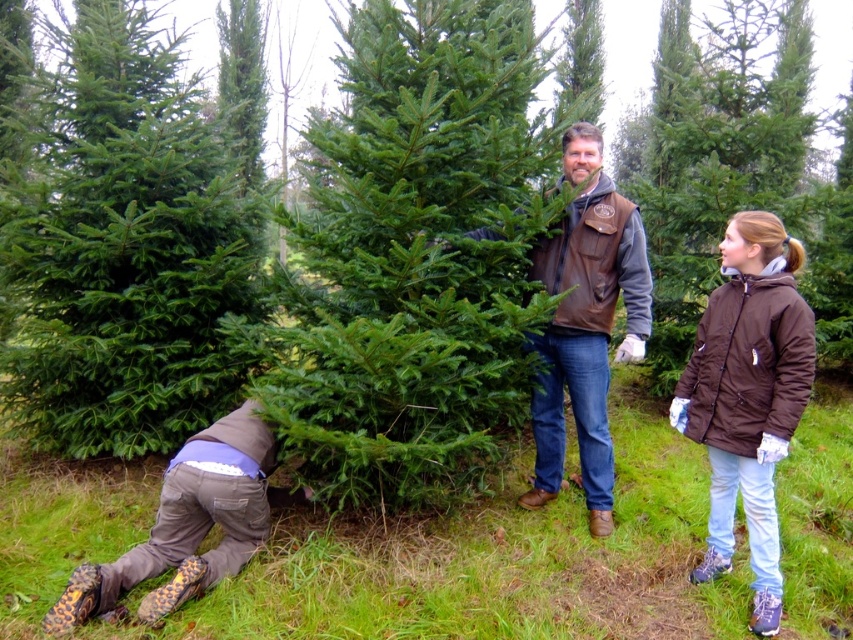
You are planning to place a new bench in the outdoor Christmas tree farm scene. The bench is 1.2 meters wide. The green matte christmas tree at center and brown puffy jacket at right are already in the scene. Can the bench fit between these two objects without overlapping them?

The green matte christmas tree at center is wider than the brown puffy jacket at right. Since the bench is 1.2 meters wide, it depends on the actual distance between the two objects. However, the description only provides information about their widths, not the space between them. Therefore, we cannot determine if the bench will fit based on the given details.

You are standing at the origin point of the coordinate system in the image. You need to locate the brown puffy jacket at right. Which direction should you move to reach it?

The brown puffy jacket at right is located at coordinate point 0.620 on the x axis and 0.878 on the y axis. Since you are at the origin, you should move right along the x axis to 0.620 and up along the y axis to 0.878 to reach it.

You are planning to take a photo of the green matte fir tree at lower left and the brown puffy jacket at right. Which object should you focus on first if you want to capture both in the same frame without moving the camera?

The green matte fir tree at lower left is above the brown puffy jacket at right, so you should focus on the green matte fir tree at lower left first to ensure both are in the frame.